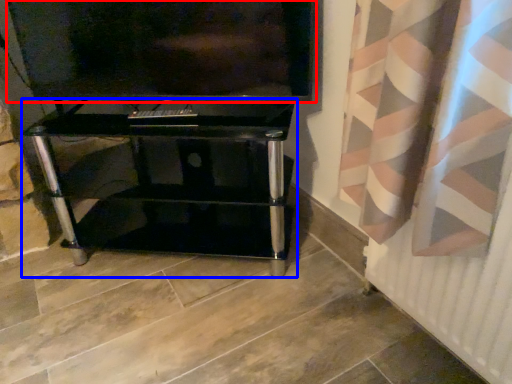
Question: Which point is further to the camera, television (highlighted by a red box) or furniture (highlighted by a blue box)?

Choices:
 (A) television
 (B) furniture

Answer: (B)